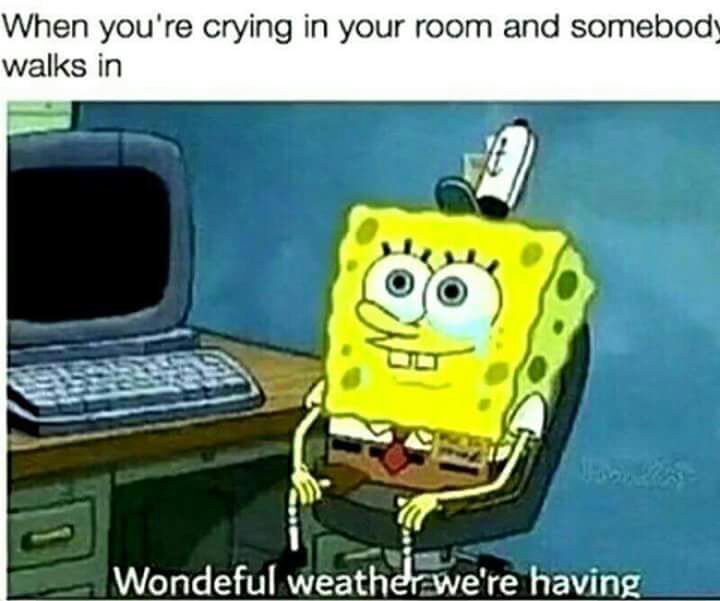
At what (x,y) coordinates should I click in order to perform the action: click on office chair. Please return your answer as a coordinate pair (x, y). This screenshot has width=720, height=601. Looking at the image, I should click on tap(490, 528).